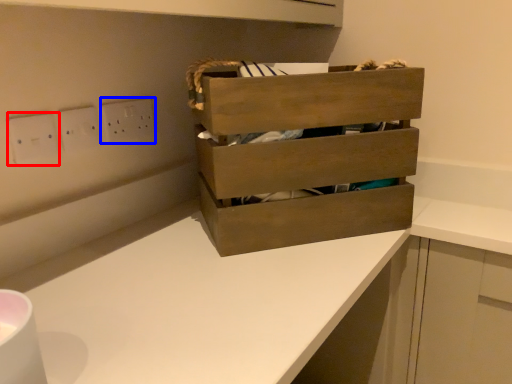
Question: Which object is closer to the camera taking this photo, electric outlet (highlighted by a red box) or electric outlet (highlighted by a blue box)?

Choices:
 (A) electric outlet
 (B) electric outlet

Answer: (A)